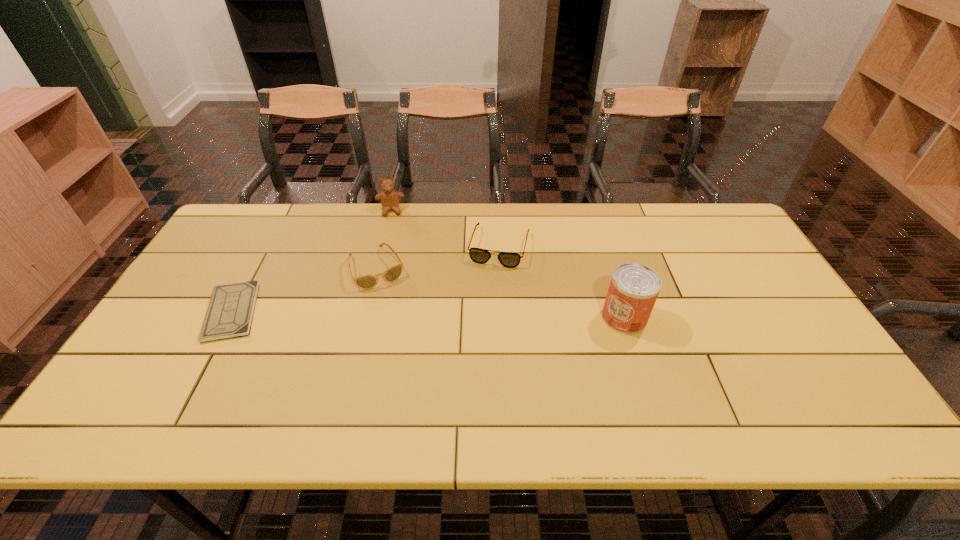
Locate an element on the screen. Image resolution: width=960 pixels, height=540 pixels. spectacles present at the far edge is located at coordinates point(507,259).

Identify the location of teddy bear at the far edge. pyautogui.click(x=389, y=197).

This screenshot has width=960, height=540. Identify the location of object at the left edge. (230, 311).

The height and width of the screenshot is (540, 960). I want to click on free space at the far edge, so click(x=569, y=242).

In the image, there is a desktop. Where is `vacant space at the left edge`? vacant space at the left edge is located at coordinates (186, 309).

This screenshot has width=960, height=540. Identify the location of free space at the right edge of the desktop. (768, 312).

The image size is (960, 540). Find the location of `vacant position at the far left corner of the desktop`. vacant position at the far left corner of the desktop is located at coordinates (224, 244).

Identify the location of vacant space at the near left corner of the desktop. (134, 383).

The width and height of the screenshot is (960, 540). In the image, there is a desktop. In order to click on vacant area at the near right corner in this screenshot , I will do `click(790, 383)`.

The width and height of the screenshot is (960, 540). Find the location of `vacant region between the spectacles and the farthest object`. vacant region between the spectacles and the farthest object is located at coordinates (445, 228).